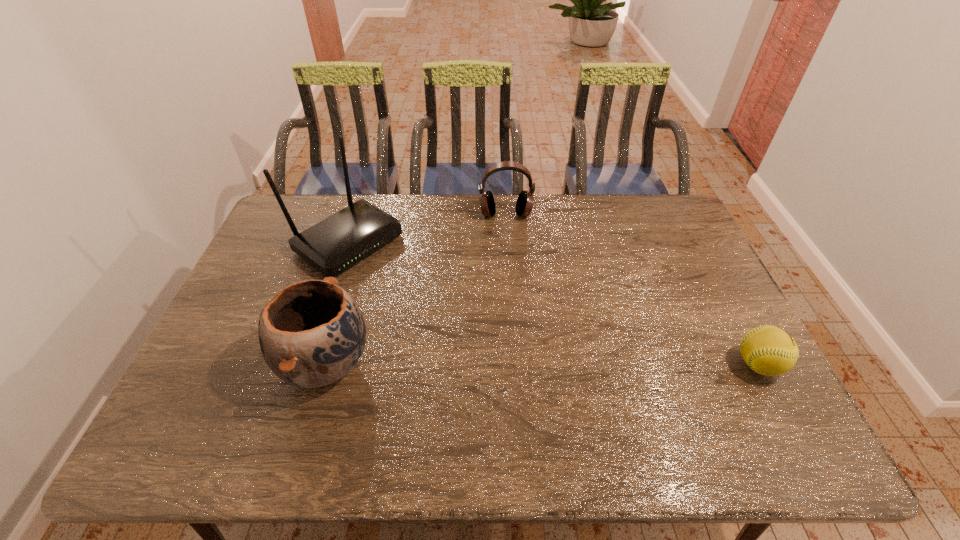
Where is `vacant space positioned 0.140m on the front-facing side of the tallest object`? vacant space positioned 0.140m on the front-facing side of the tallest object is located at coordinates (414, 288).

Where is `vacant region located 0.050m on the front-facing side of the tallest object`? vacant region located 0.050m on the front-facing side of the tallest object is located at coordinates (394, 274).

Where is `headset situated at the far edge`? headset situated at the far edge is located at coordinates (525, 200).

Where is `router positioned at the far edge`? The height and width of the screenshot is (540, 960). router positioned at the far edge is located at coordinates (333, 245).

Locate an element on the screen. The height and width of the screenshot is (540, 960). pottery at the near edge is located at coordinates (312, 333).

Where is `softball that is at the near edge`? softball that is at the near edge is located at coordinates (768, 350).

Find the location of a particular element. The image size is (960, 540). object that is positioned at the left edge is located at coordinates (333, 245).

Where is `object at the right edge`? object at the right edge is located at coordinates (768, 350).

Find the location of `object that is at the far left corner`. object that is at the far left corner is located at coordinates (333, 245).

In order to click on object that is at the near right corner in this screenshot , I will do `click(768, 350)`.